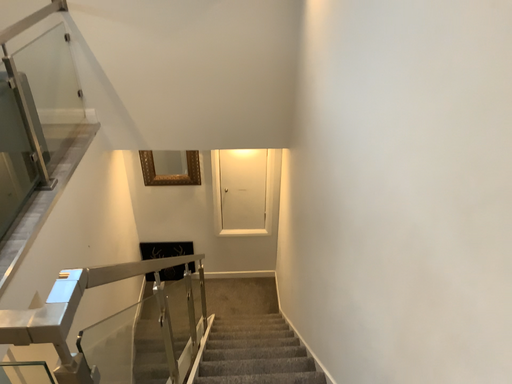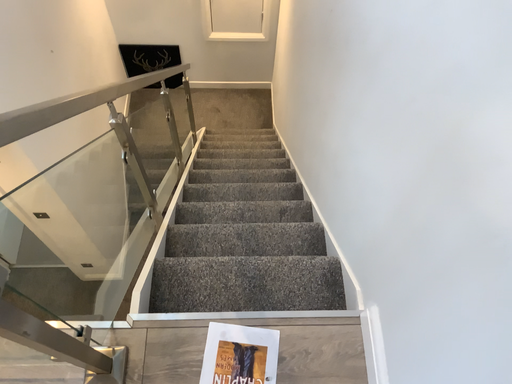
Question: Which way did the camera rotate in the video?

Choices:
 (A) rotated downward
 (B) rotated upward

Answer: (A)